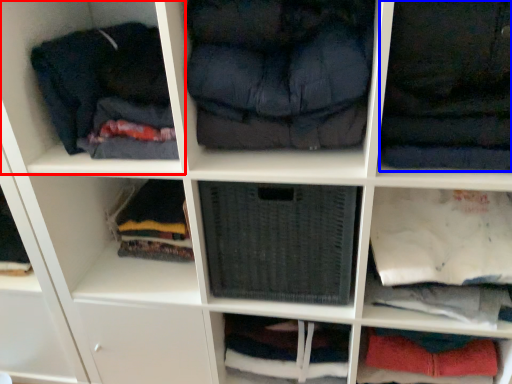
Question: Which object is further to the camera taking this photo, shelf (highlighted by a red box) or clothing (highlighted by a blue box)?

Choices:
 (A) shelf
 (B) clothing

Answer: (A)